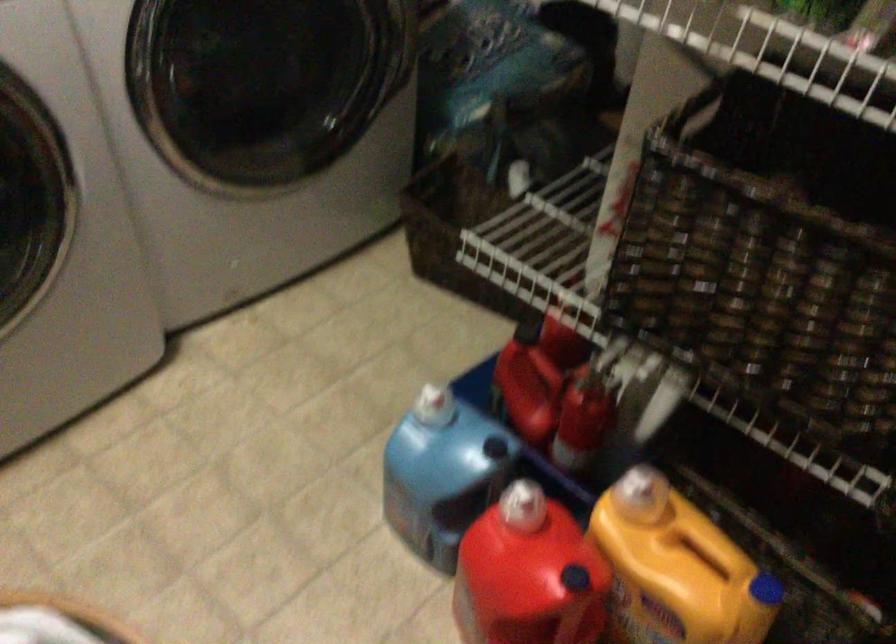
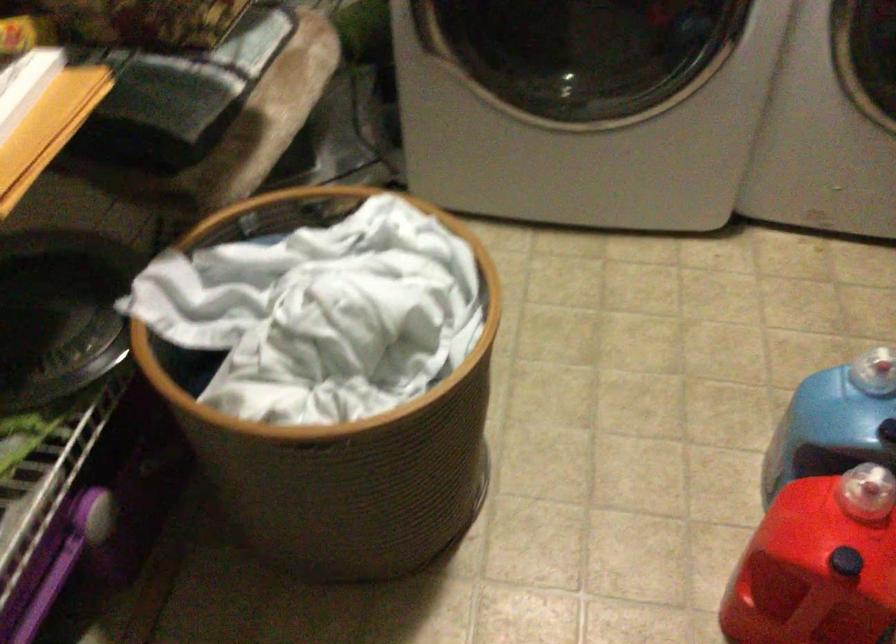
Locate, in the second image, the point that corresponds to [440,460] in the first image.

(839, 418)